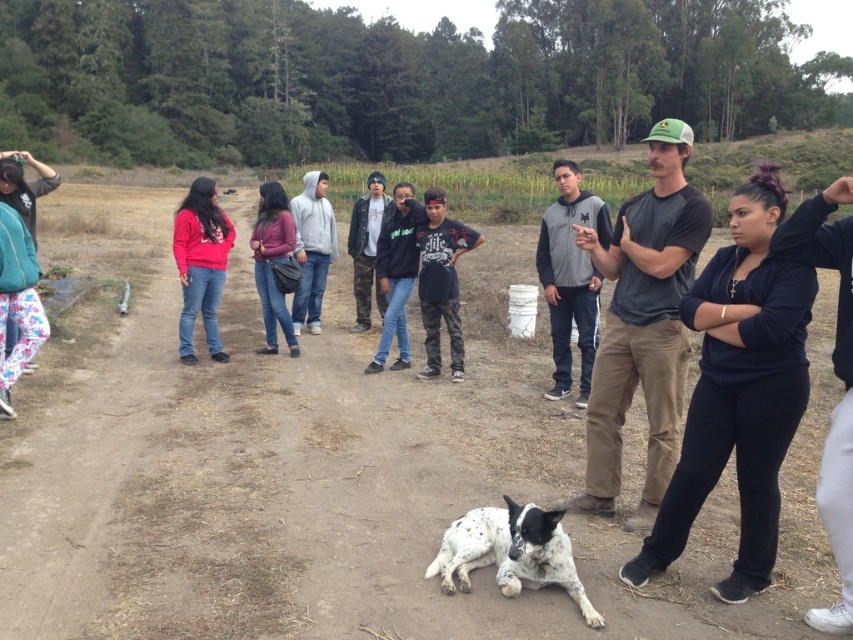
You are planning to set up a small tent for a quick picnic in the brown dirt field at center and the gray fleece jacket at center. Which location would be more suitable for placing the tent based on their sizes?

The brown dirt field at center is larger in size than the gray fleece jacket at center, so the tent should be placed on the brown dirt field at center as it provides enough space.

You are standing in the middle of the brown dirt field at center and want to walk to the gray fleece jacket at center. Which direction should you move?

You should move to the right because the brown dirt field at center is to the left of the gray fleece jacket at center, so moving right will take you towards the jacket.